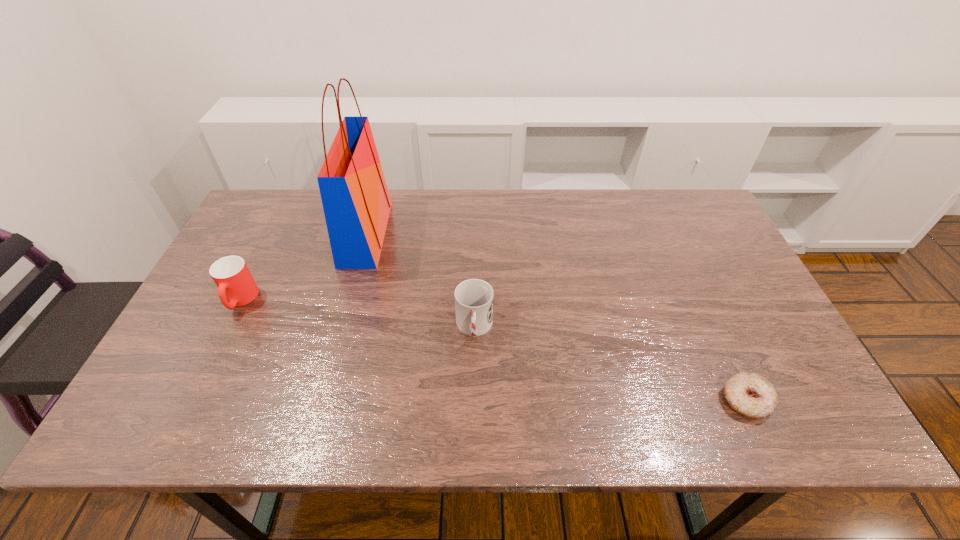
Identify the location of object that is at the far edge. This screenshot has width=960, height=540. (356, 202).

At what (x,y) coordinates should I click in order to perform the action: click on object that is at the near edge. Please return your answer as a coordinate pair (x, y). Looking at the image, I should click on coord(749,394).

You are a GUI agent. You are given a task and a screenshot of the screen. Output one action in this format:
    pyautogui.click(x=<x>, y=<y>)
    Task: Click on the object that is at the left edge
    This screenshot has height=540, width=960.
    Given the screenshot: What is the action you would take?
    pyautogui.click(x=236, y=287)

Where is `object present at the right edge`? This screenshot has height=540, width=960. object present at the right edge is located at coordinates (749, 394).

At what (x,y) coordinates should I click in order to perform the action: click on object located in the near right corner section of the desktop. Please return your answer as a coordinate pair (x, y). The height and width of the screenshot is (540, 960). Looking at the image, I should click on (749, 394).

Find the location of a particular element. The height and width of the screenshot is (540, 960). vacant position at the far edge of the desktop is located at coordinates click(x=421, y=229).

In the image, there is a desktop. What are the coordinates of `free space at the near edge` in the screenshot? It's located at (301, 399).

The image size is (960, 540). In the image, there is a desktop. What are the coordinates of `free space at the left edge` in the screenshot? It's located at (254, 271).

Locate an element on the screen. free space at the right edge is located at coordinates (695, 267).

At what (x,y) coordinates should I click in order to perform the action: click on free space at the far left corner. Please return your answer as a coordinate pair (x, y). This screenshot has width=960, height=540. Looking at the image, I should click on (270, 194).